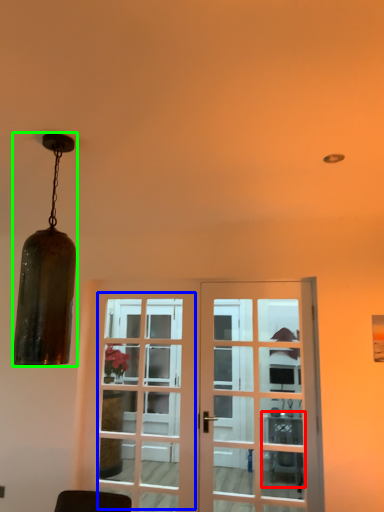
Question: Which is nearer to the table (highlighted by a red box)? screen door (highlighted by a blue box) or lamp (highlighted by a green box).

Choices:
 (A) screen door
 (B) lamp

Answer: (A)